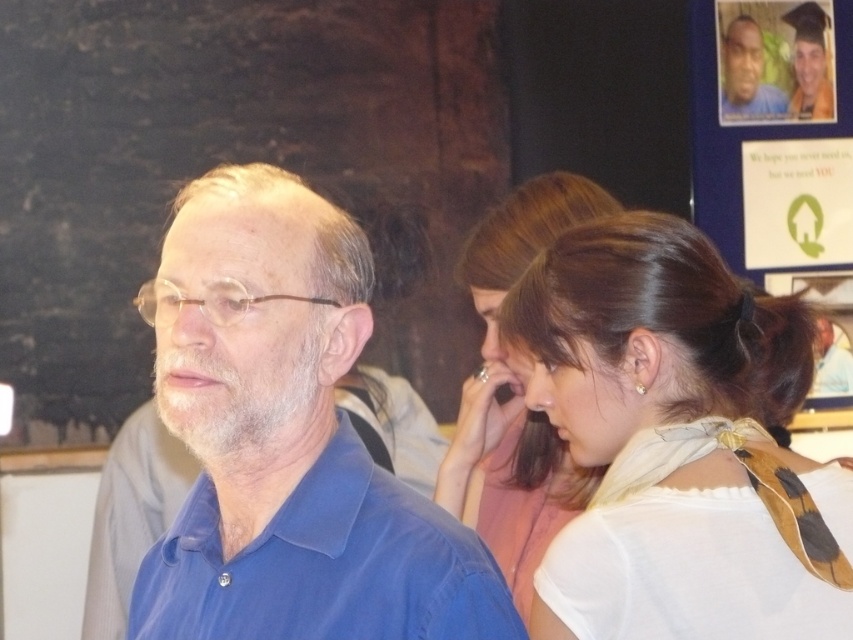
You are a photographer setting up for a group photo. You need to ensure that the blue cotton shirt at left and the goldearring at right are both in frame. Based on their sizes, which object should you focus on first to ensure both are visible?

The blue cotton shirt at left is wider than the goldearring at right, so you should focus on the blue cotton shirt at left first to ensure both are visible.

You are a photographer trying to capture a closeup of the blue cotton shirt at left without including the white silk scarf at upper right in the frame. Is this possible given their positions?

The white silk scarf at upper right is located above the blue cotton shirt at left, so it may be challenging to capture the blue cotton shirt at left without including the white silk scarf at upper right in the frame. Adjusting the camera angle downward might help exclude the scarf.